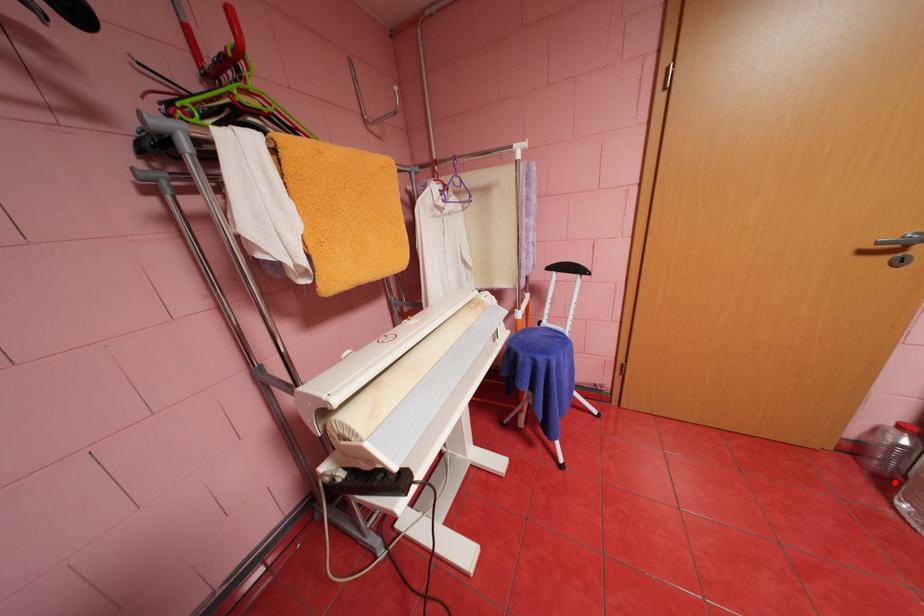
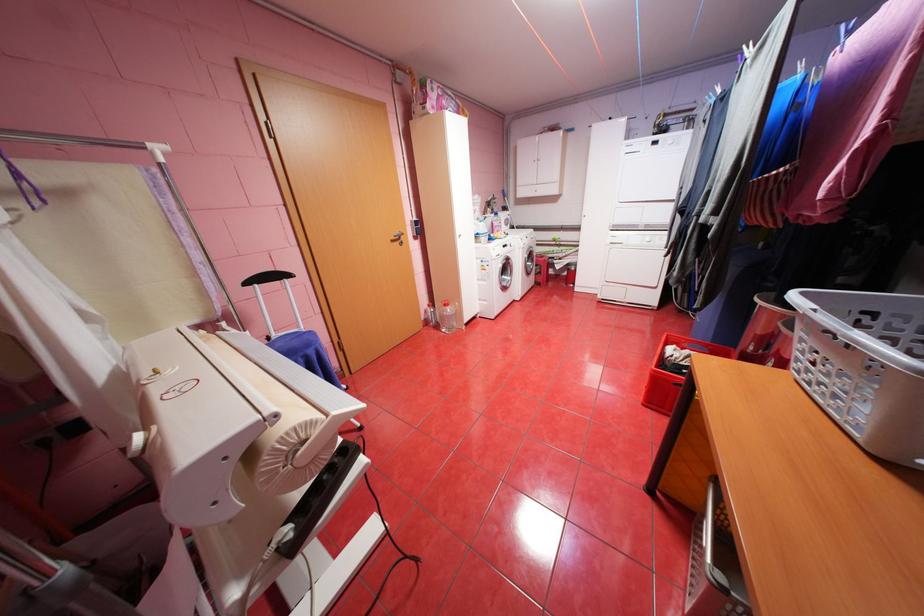
Question: I am providing you with two images of the same scene from different viewpoints. Given a red point in image1, look at the same physical point in image2. Is it:

Choices:
 (A) Closer to the viewpoint
 (B) Farther from the viewpoint

Answer: (B)